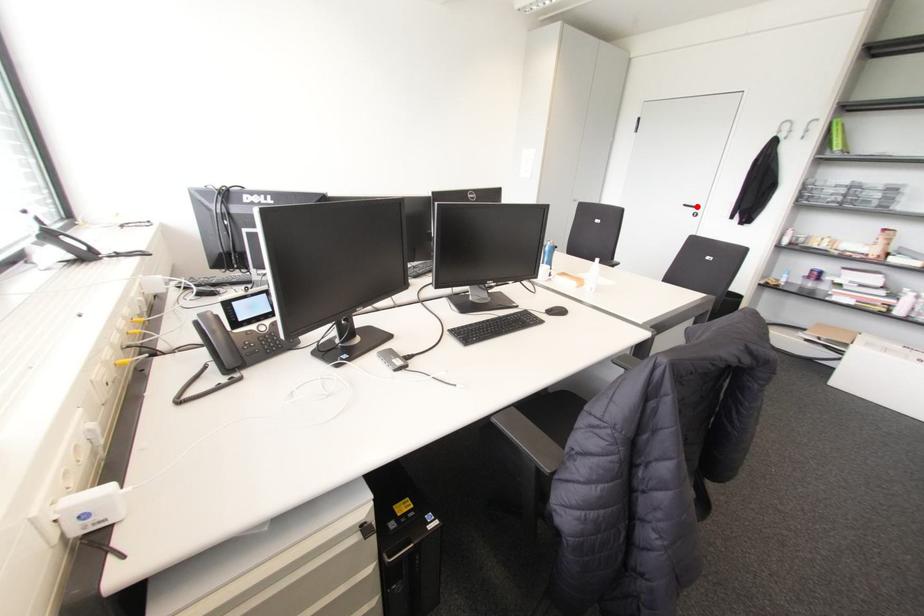
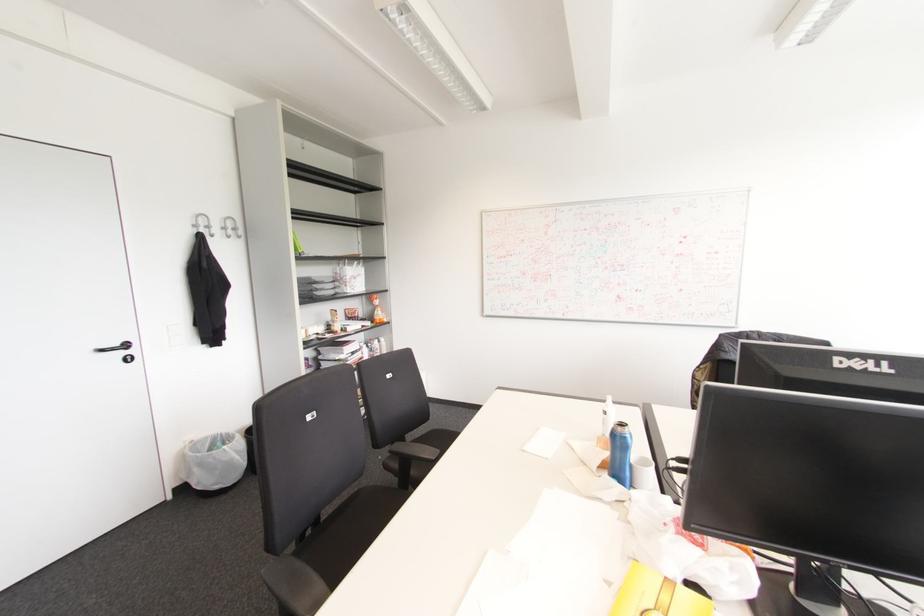
The point at the highlighted location is marked in the first image. Where is the corresponding point in the second image?

(126, 345)